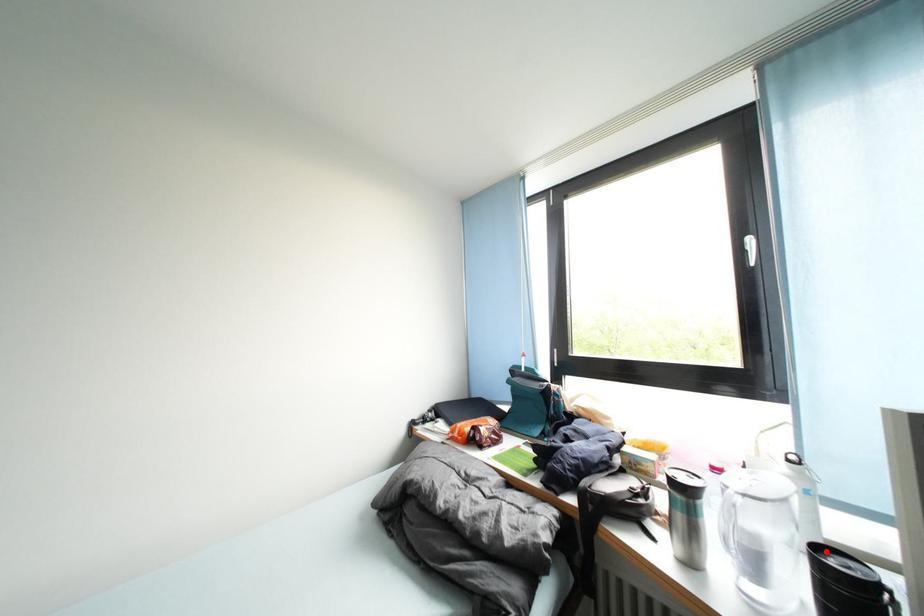
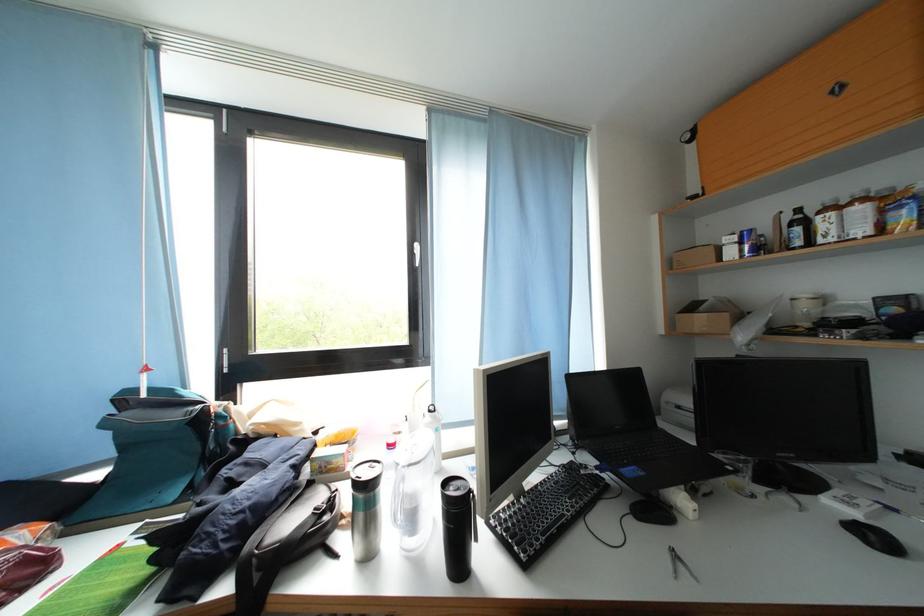
The point at the highlighted location is marked in the first image. Where is the corresponding point in the second image?

(454, 488)